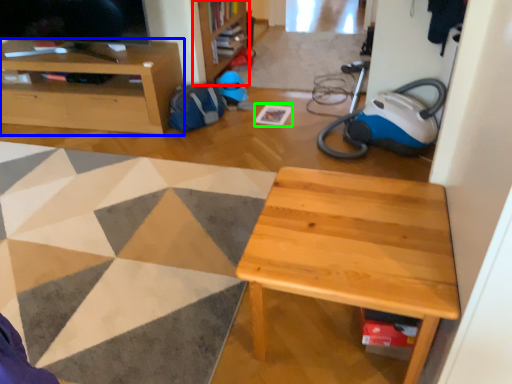
Question: Which object is the farthest from bookshelf (highlighted by a red box)? Choose among these: cabinetry (highlighted by a blue box) or square (highlighted by a green box).

Choices:
 (A) cabinetry
 (B) square

Answer: (A)